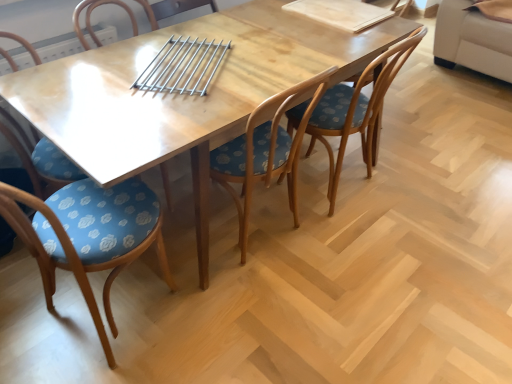
Question: Is blue floral fabric chair at lower left, which is the 1th chair from left to right, behind wooden table at center?

Choices:
 (A) no
 (B) yes

Answer: (B)

Question: Considering the relative sizes of blue floral fabric chair at lower left, the 4th chair positioned from the right, and wooden table at center in the image provided, is blue floral fabric chair at lower left, the 4th chair positioned from the right, bigger than wooden table at center?

Choices:
 (A) no
 (B) yes

Answer: (A)

Question: From the image's perspective, is blue floral fabric chair at lower left, the 4th chair positioned from the right, beneath wooden table at center?

Choices:
 (A) yes
 (B) no

Answer: (A)

Question: From a real-world perspective, is blue floral fabric chair at lower left, which is the 1th chair from left to right, located beneath wooden table at center?

Choices:
 (A) no
 (B) yes

Answer: (A)

Question: Is wooden table at center located within blue floral fabric chair at lower left, which is the 1th chair from left to right?

Choices:
 (A) no
 (B) yes

Answer: (A)

Question: Is blue fabric chair at center, positioned as the 3th chair in right-to-left order, wider or thinner than blue floral fabric chair at lower left, the 4th chair positioned from the right?

Choices:
 (A) thin
 (B) wide

Answer: (A)

Question: Would you say blue fabric chair at center, marked as the second chair in a left-to-right arrangement, is inside or outside blue floral fabric chair at lower left, which is the 1th chair from left to right?

Choices:
 (A) inside
 (B) outside

Answer: (B)

Question: From their relative heights in the image, would you say blue fabric chair at center, positioned as the 3th chair in right-to-left order, is taller or shorter than blue floral fabric chair at lower left, which is the 1th chair from left to right?

Choices:
 (A) short
 (B) tall

Answer: (B)

Question: Is blue fabric chair at center, marked as the second chair in a left-to-right arrangement, bigger or smaller than blue floral fabric chair at lower left, the 4th chair positioned from the right?

Choices:
 (A) big
 (B) small

Answer: (A)

Question: Is wooden table at center wider or thinner than blue fabric chair at center, marked as the second chair in a left-to-right arrangement?

Choices:
 (A) wide
 (B) thin

Answer: (A)

Question: From a real-world perspective, is wooden table at center positioned above or below blue fabric chair at center, positioned as the 3th chair in right-to-left order?

Choices:
 (A) above
 (B) below

Answer: (B)

Question: Is wooden table at center inside or outside of blue fabric chair at center, marked as the second chair in a left-to-right arrangement?

Choices:
 (A) inside
 (B) outside

Answer: (B)

Question: Considering their positions, is wooden table at center located in front of or behind blue fabric chair at center, positioned as the 3th chair in right-to-left order?

Choices:
 (A) behind
 (B) front

Answer: (A)

Question: Is wooden chair with floral cushion at center, the second chair in the right-to-left sequence, situated inside wooden table at center or outside?

Choices:
 (A) inside
 (B) outside

Answer: (A)

Question: Is point (285, 110) closer or farther from the camera than point (286, 84)?

Choices:
 (A) closer
 (B) farther

Answer: (B)